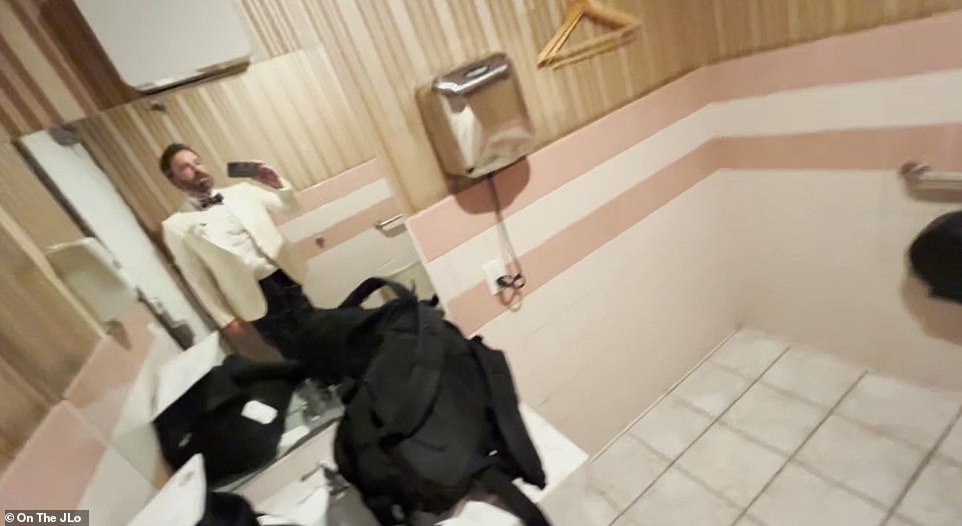
The width and height of the screenshot is (962, 526). I want to click on bathroom, so click(693, 333).